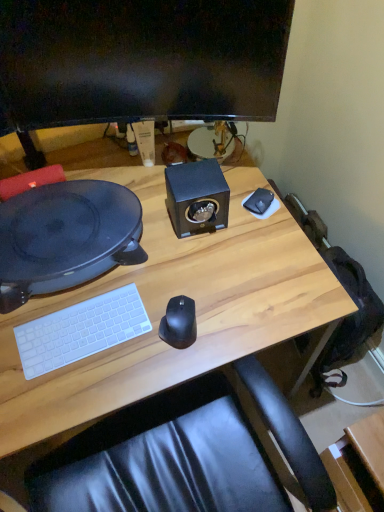
The image size is (384, 512). Find the location of `unoccupied space behind white matte keyboard at lower left`. unoccupied space behind white matte keyboard at lower left is located at coordinates (106, 277).